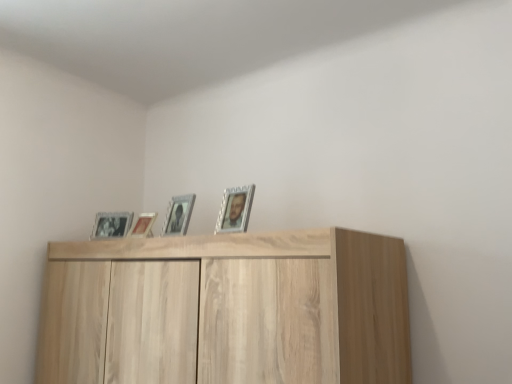
Question: Is point (122, 230) closer or farther from the camera than point (192, 198)?

Choices:
 (A) farther
 (B) closer

Answer: (B)

Question: In terms of height, does metallic silver photo frame at upper left, the fourth picture frame when ordered from right to left, look taller or shorter compared to metallic silver picture frame at center, which is counted as the 2th picture frame, starting from the front?

Choices:
 (A) tall
 (B) short

Answer: (B)

Question: Which is farther from the metallic silver picture frame at center, the third picture frame viewed from the back?

Choices:
 (A) light wood cupboard at upper center
 (B) metallic silver photo frame at upper left, which ranks as the 4th picture frame in front-to-back order
 (C) silver metallic picture frame at upper center, which is the 1th picture frame from front to back
 (D) matte silver picture frame at center, which is the third picture frame in front-to-back order

Answer: (A)

Question: Which object is the closest to the light wood cupboard at upper center?

Choices:
 (A) matte silver picture frame at center, arranged as the 3th picture frame when viewed from the right
 (B) silver metallic picture frame at upper center, the fourth picture frame when ordered from back to front
 (C) metallic silver picture frame at center, arranged as the third picture frame when viewed from the left
 (D) metallic silver photo frame at upper left, which appears as the 1th picture frame when viewed from the back

Answer: (B)